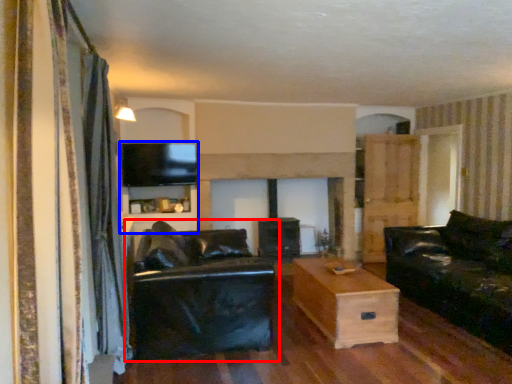
Question: Which of the following is the farthest to the observer, studio couch (highlighted by a red box) or entertainment center (highlighted by a blue box)?

Choices:
 (A) studio couch
 (B) entertainment center

Answer: (B)